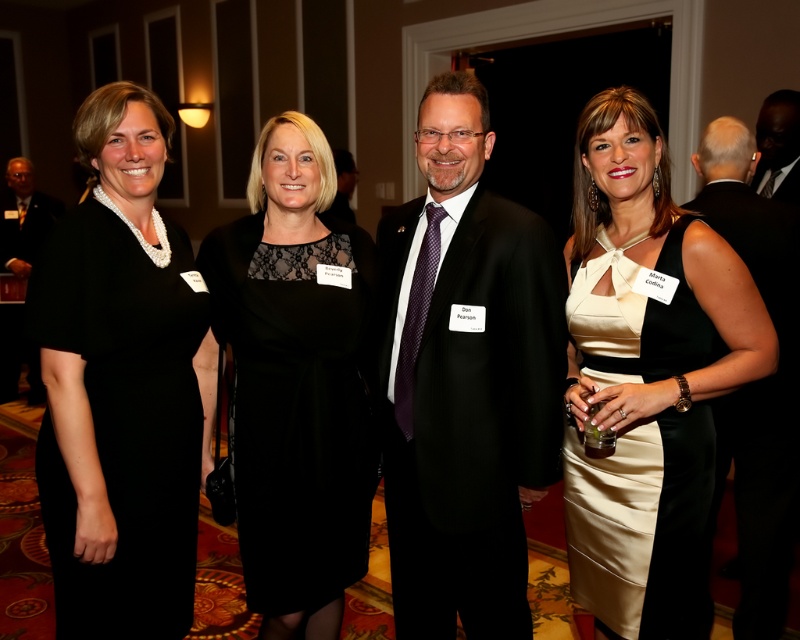
Who is positioned more to the left, black lace dress at center or dark gray wool business suit at center?

Positioned to the left is black lace dress at center.

Is point (322, 148) closer to camera compared to point (764, 166)?

Yes, it is in front of point (764, 166).

Between point (340, 371) and point (756, 180), which one is positioned behind?

The point (756, 180) is behind.

Locate an element on the screen. The height and width of the screenshot is (640, 800). black lace dress at center is located at coordinates (296, 381).

Can you confirm if white satin dress at center is positioned above dark gray wool business suit at center?

No, white satin dress at center is not above dark gray wool business suit at center.

Measure the distance between white satin dress at center and camera.

white satin dress at center and camera are 1.48 meters apart from each other.

Locate an element on the screen. The width and height of the screenshot is (800, 640). white satin dress at center is located at coordinates (645, 374).

Can you confirm if black satin dress at left is positioned to the right of black satin suit at right?

No, black satin dress at left is not to the right of black satin suit at right.

Between point (144, 400) and point (730, 236), which one is positioned in front?

Point (144, 400) is in front.

Image resolution: width=800 pixels, height=640 pixels. Identify the location of black satin dress at left. (124, 420).